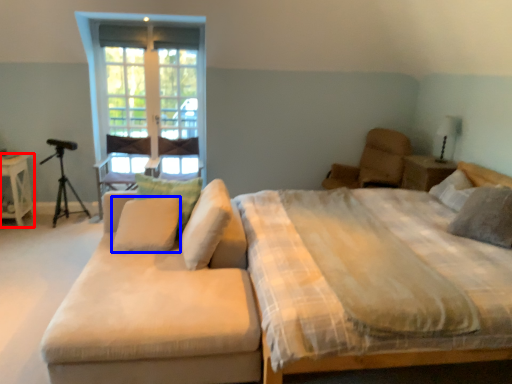
Question: Among these objects, which one is farthest to the camera, nightstand (highlighted by a red box) or pillow (highlighted by a blue box)?

Choices:
 (A) nightstand
 (B) pillow

Answer: (A)